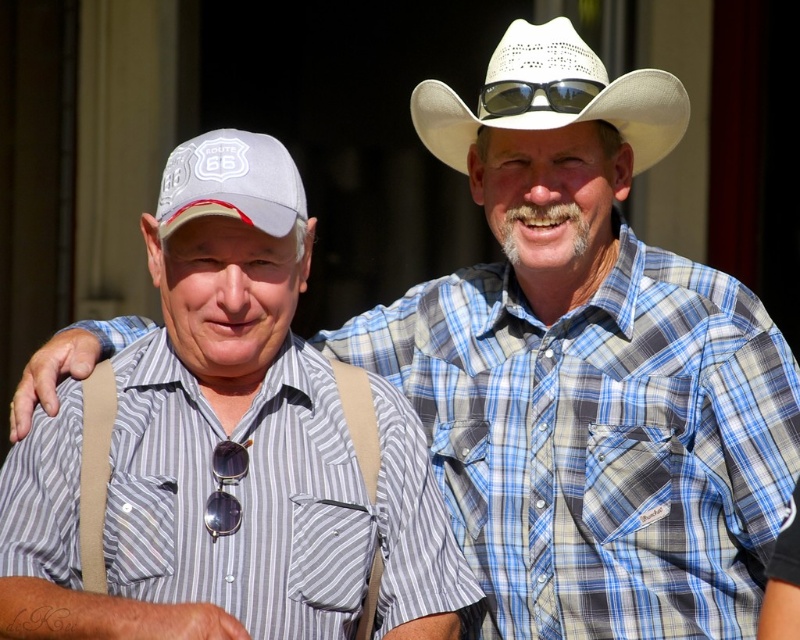
Can you confirm if striped cotton shirt at center is positioned below sunglasses at center?

Yes, striped cotton shirt at center is below sunglasses at center.

Is striped cotton shirt at center further to the viewer compared to sunglasses at center?

No.

In order to click on striped cotton shirt at center in this screenshot , I will do `click(274, 502)`.

What are the coordinates of `striped cotton shirt at center` in the screenshot? It's located at (274, 502).

Can you confirm if white woven cowboy hat at upper center is shorter than sunglasses at center?

In fact, white woven cowboy hat at upper center may be taller than sunglasses at center.

At what (x,y) coordinates should I click in order to perform the action: click on white woven cowboy hat at upper center. Please return your answer as a coordinate pair (x, y). This screenshot has width=800, height=640. Looking at the image, I should click on (552, 97).

Is point (284, 225) less distant than point (544, 106)?

Yes, point (284, 225) is closer to viewer.

Between white fabric baseball cap at left and sunglasses at center, which one has less height?

sunglasses at center is shorter.

In the scene shown: Measure the distance between white fabric baseball cap at left and camera.

They are 28.35 feet apart.

Where is `white fabric baseball cap at left`? white fabric baseball cap at left is located at coordinates (232, 184).